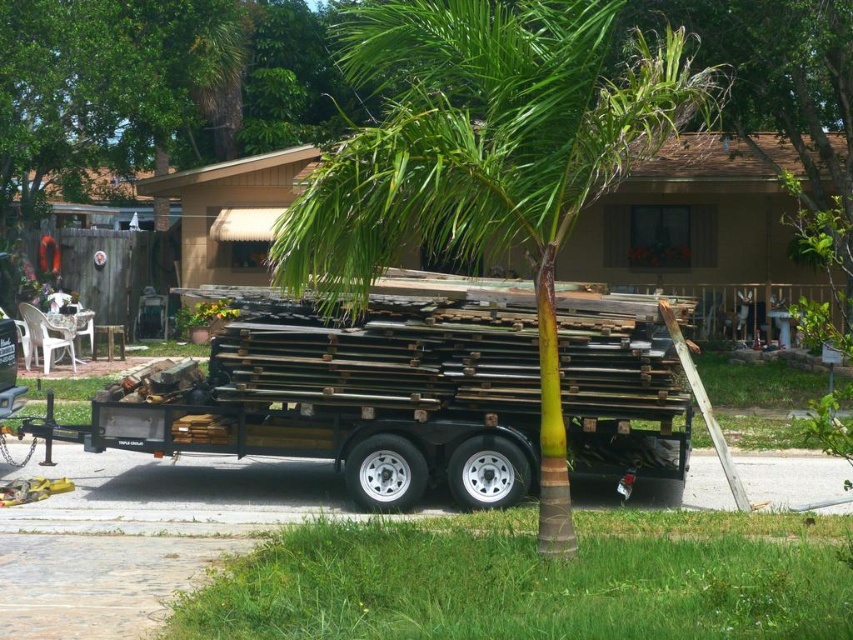
Between wooden planks at center and green leafy palm tree at center, which one has less height?

With less height is wooden planks at center.

Can you confirm if wooden planks at center is positioned above green leafy palm tree at center?

Answer: No, wooden planks at center is not above green leafy palm tree at center.

Identify the location of wooden planks at center. (352, 392).

What are the coordinates of `wooden planks at center` in the screenshot? It's located at (352, 392).